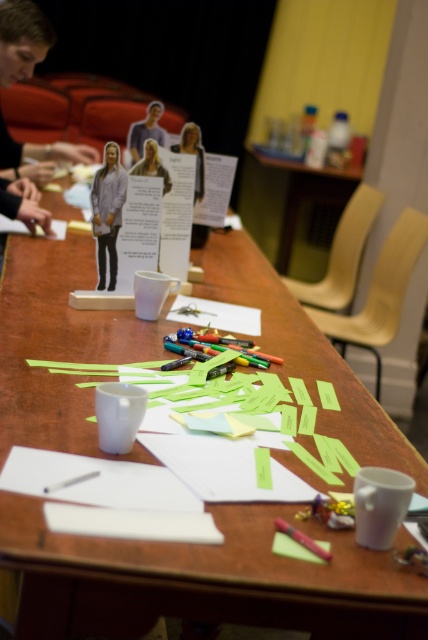
From the picture: You are organizing a workshop and need to place a new object between the matte gray figure at upper left and the matte cardboard figure at center. Considering their sizes, which figure should the new object be placed closer to?

The new object should be placed closer to the matte cardboard figure at center because the matte gray figure at upper left is larger in size and thus requires more space between them.

You are standing at the end of the table and want to reach both the point at (x=136, y=140) and the point at (x=293, y=532). Which point will you reach first?

You will reach the point at (x=136, y=140) first because it is closer to you than the point at (x=293, y=532).

You are organizing a workshop and need to place a new item between the matte gray figure at upper left and the pink matte pen at lower center. Considering their sizes, which object should you place closer to the center of the table?

The matte gray figure at upper left is taller than the pink matte pen at lower center, so to balance the space, you should place the pink matte pen at lower center closer to the center of the table since it is shorter.